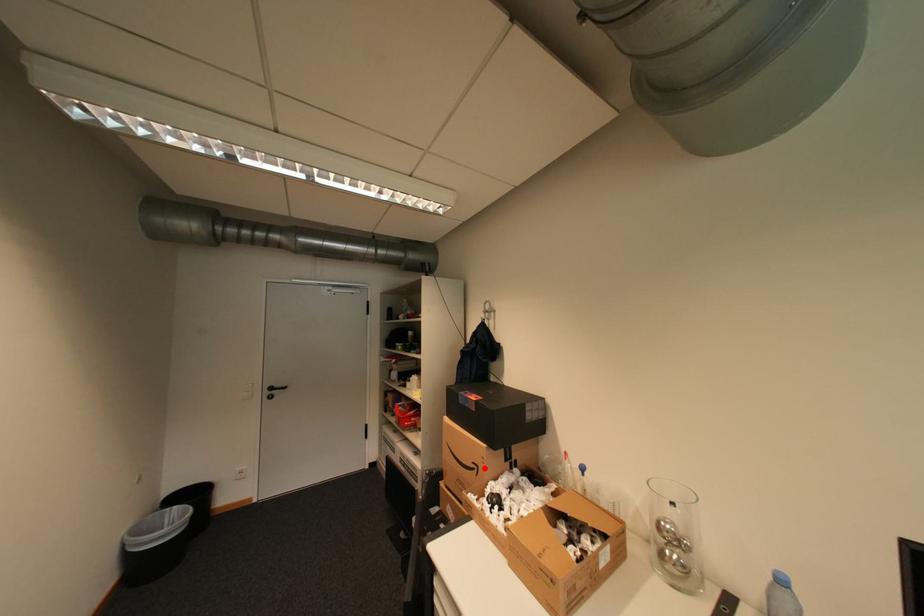
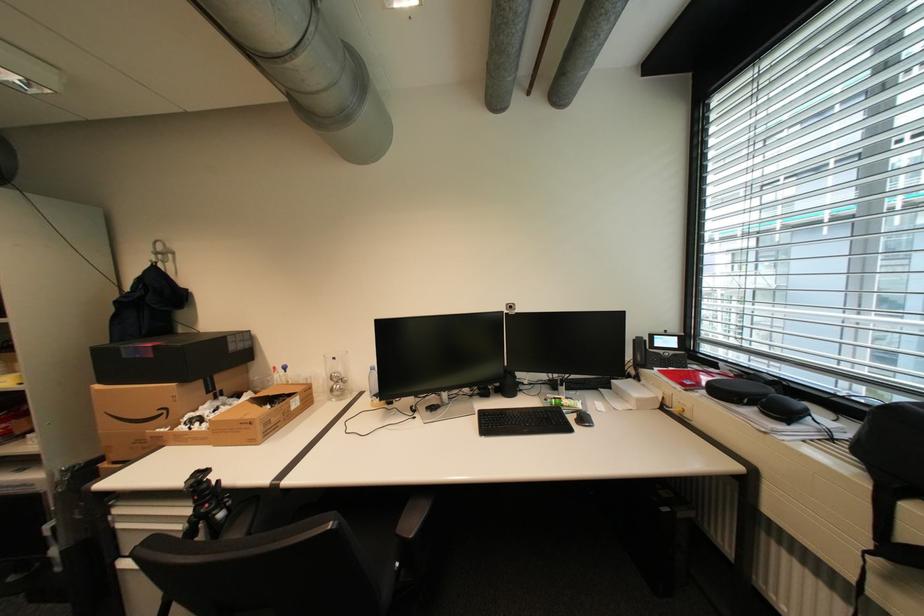
Question: I am providing you with two images of the same scene from different viewpoints. Given a red point in image1, look at the same physical point in image2. Is it:

Choices:
 (A) Closer to the viewpoint
 (B) Farther from the viewpoint

Answer: (A)